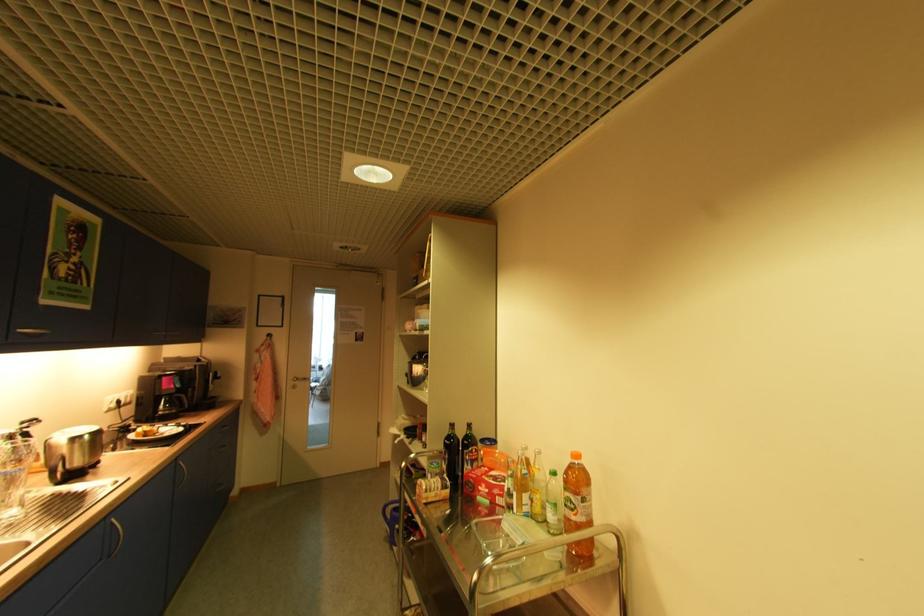
The width and height of the screenshot is (924, 616). What do you see at coordinates (578, 505) in the screenshot?
I see `the orange plastic bottle` at bounding box center [578, 505].